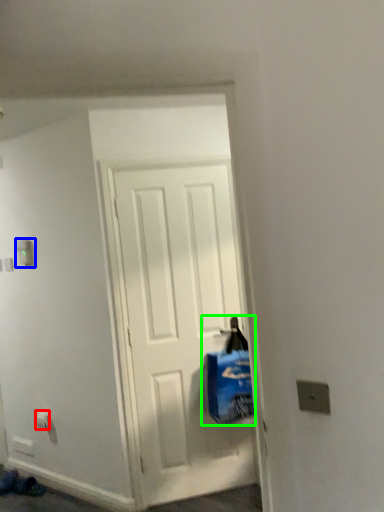
Question: Which object is the farthest from electric outlet (highlighted by a red box)? Choose among these: light switch (highlighted by a blue box) or shopping bag (highlighted by a green box).

Choices:
 (A) light switch
 (B) shopping bag

Answer: (B)